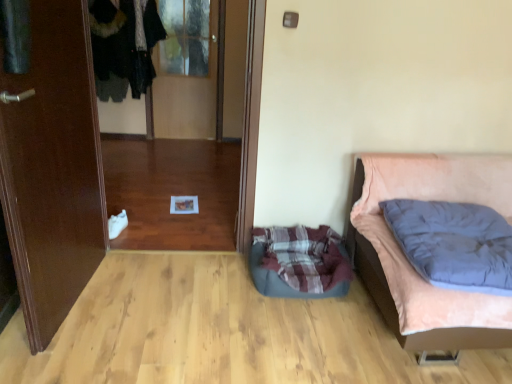
I want to click on space that is in front of plaid fabric dog bed at lower center, so click(305, 330).